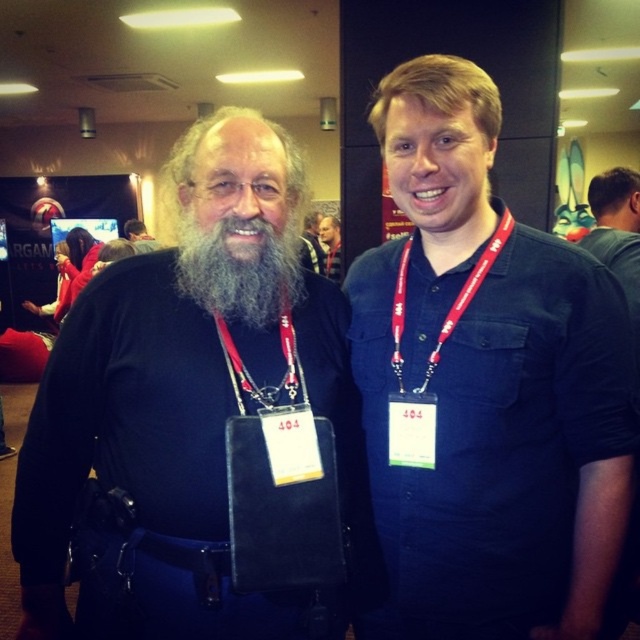
Question: Does blue denim shirt at center appear over matte blue shirt at center?

Choices:
 (A) no
 (B) yes

Answer: (A)

Question: Which of the following is the farthest from the observer?

Choices:
 (A) (225, 225)
 (B) (406, 256)
 (C) (268, 237)

Answer: (B)

Question: Which point appears closest to the camera in this image?

Choices:
 (A) (348, 509)
 (B) (285, 296)

Answer: (B)

Question: Considering the real-world distances, which object is farthest from the blue denim shirt at center?

Choices:
 (A) black matte jacket at left
 (B) gray beard at center
 (C) red fabric lanyard at center

Answer: (B)

Question: Can you confirm if black matte jacket at left is positioned to the left of red fabric lanyard at center?

Choices:
 (A) no
 (B) yes

Answer: (B)

Question: Observing the image, what is the correct spatial positioning of graybeard at center in reference to red fabric lanyard at center?

Choices:
 (A) left
 (B) right

Answer: (A)